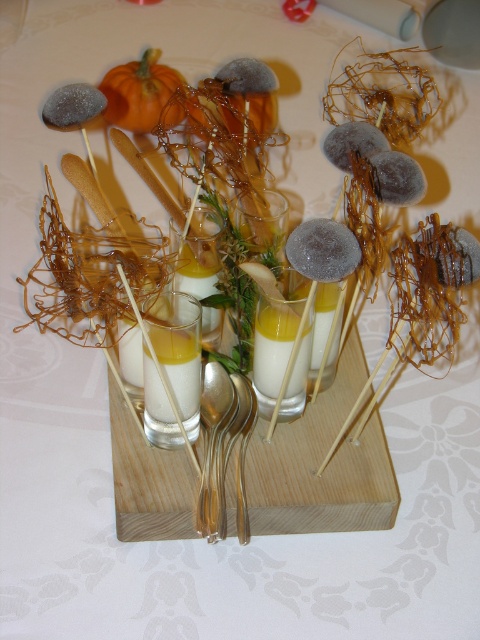
Question: Does gold metallic spoon at center appear under yellow translucent juice at center?

Choices:
 (A) no
 (B) yes

Answer: (B)

Question: Which point is farther to the camera?

Choices:
 (A) (177, 349)
 (B) (280, 316)

Answer: (B)

Question: Which of the following is the farthest from the observer?

Choices:
 (A) yellow translucent juice at center
 (B) gold metallic spoon at center

Answer: (B)

Question: From the image, what is the correct spatial relationship of gold metallic spoon at center in relation to yellow translucent juice at center?

Choices:
 (A) below
 (B) above

Answer: (A)

Question: Is gold metallic spoon at center below yellow translucent liquid at center?

Choices:
 (A) yes
 (B) no

Answer: (A)

Question: Which point is farther to the camera?

Choices:
 (A) yellow translucent liquid at center
 (B) gold metallic spoon at center
 (C) yellow translucent juice at center

Answer: (A)